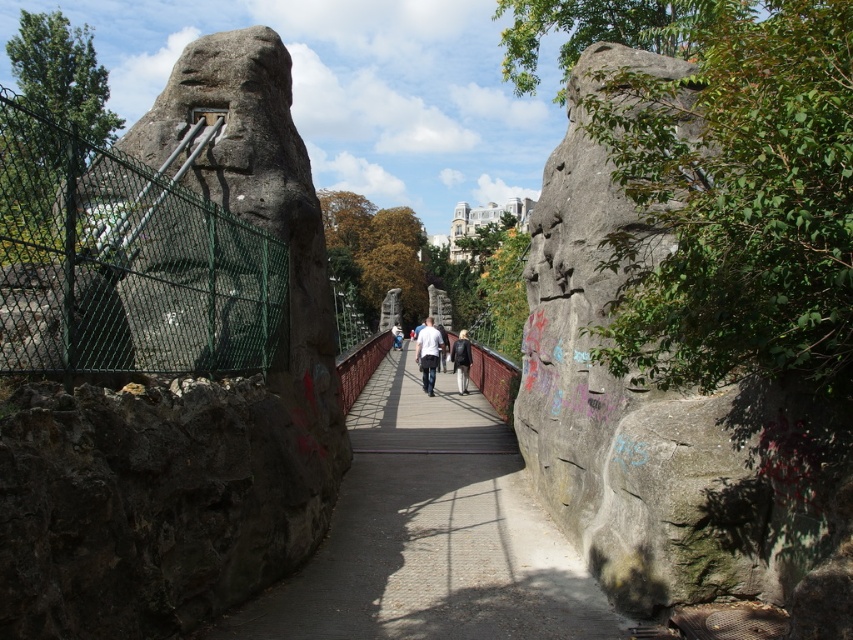
Does gray rough rock at right have a greater width compared to white cotton shirt at center?

Yes.

Who is lower down, gray rough rock at right or white cotton shirt at center?

Positioned lower is gray rough rock at right.

Where is `gray rough rock at right`? This screenshot has width=853, height=640. gray rough rock at right is located at coordinates click(668, 424).

Between gray rough rock at right and white matte shirt at center, which one has less height?

white matte shirt at center is shorter.

How far apart are gray rough rock at right and white matte shirt at center?

The distance of gray rough rock at right from white matte shirt at center is 67.62 meters.

Does point (637, 568) come farther from viewer compared to point (438, 336)?

That is False.

Where is `gray rough rock at right`? gray rough rock at right is located at coordinates (668, 424).

Which is more to the left, wooden bridge at center or dark brown leather jacket at center?

From the viewer's perspective, wooden bridge at center appears more on the left side.

Is wooden bridge at center bigger than dark brown leather jacket at center?

No, wooden bridge at center is not bigger than dark brown leather jacket at center.

Locate an element on the screen. wooden bridge at center is located at coordinates (430, 536).